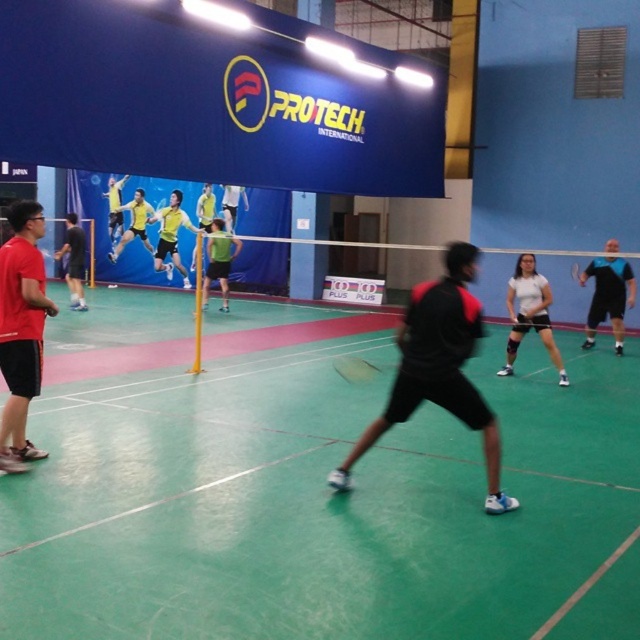
Is yellow-green shirt at center positioned before green fabric shorts at center?

No, yellow-green shirt at center is further to the viewer.

Does yellow-green shirt at center appear on the left side of green fabric shorts at center?

Correct, you'll find yellow-green shirt at center to the left of green fabric shorts at center.

At what (x,y) coordinates should I click in order to perform the action: click on yellow-green shirt at center. Please return your answer as a coordinate pair (x, y). Looking at the image, I should click on (205, 208).

You are a GUI agent. You are given a task and a screenshot of the screen. Output one action in this format:
    pyautogui.click(x=<x>, y=<y>)
    Task: Click on the yellow-green shirt at center
    This screenshot has width=640, height=640.
    Given the screenshot: What is the action you would take?
    pyautogui.click(x=205, y=208)

Can you confirm if green matte shirt at center is smaller than yellow shirt at upper left?

Actually, green matte shirt at center might be larger than yellow shirt at upper left.

Measure the distance between green matte shirt at center and camera.

green matte shirt at center is 16.22 meters away from camera.

Based on the photo, who is more distant from viewer, (240, 250) or (116, 196)?

Point (116, 196)

At what (x,y) coordinates should I click in order to perform the action: click on green matte shirt at center. Please return your answer as a coordinate pair (x, y). Image resolution: width=640 pixels, height=640 pixels. Looking at the image, I should click on (220, 260).

Does green matte shirt at center lie in front of black rubber racket at center?

No, it is behind black rubber racket at center.

In order to click on green matte shirt at center in this screenshot , I will do `click(220, 260)`.

Is point (230, 256) closer to viewer compared to point (356, 364)?

That is False.

The width and height of the screenshot is (640, 640). What are the coordinates of `green matte shirt at center` in the screenshot? It's located at (220, 260).